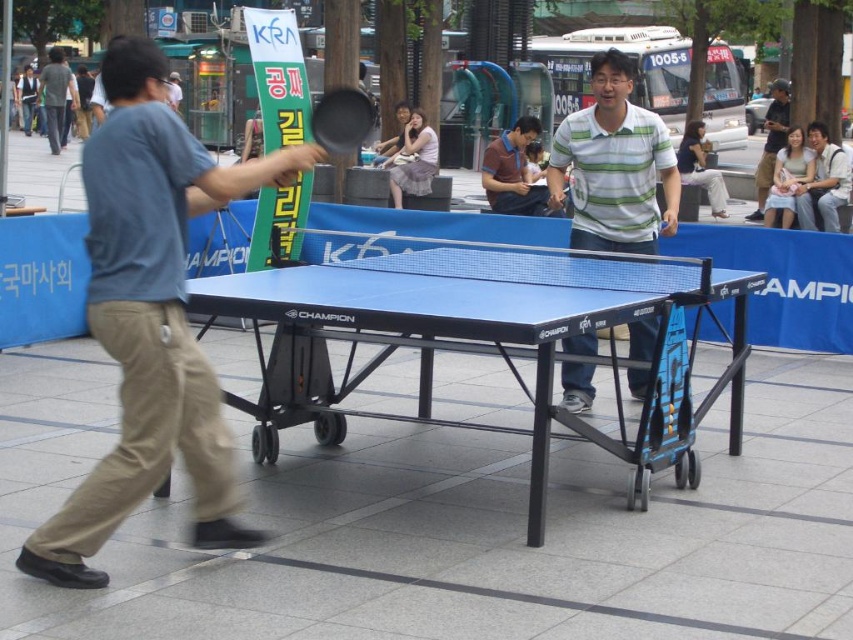
You are a photographer positioned at the edge of the plaza. You want to capture a photo where the light brown leather jacket at upper right is visible without being blocked by the dark blue jeans at center. Based on their current positions, is this possible?

Yes, the light brown leather jacket at upper right is in front of the dark blue jeans at center, so it will block the view of the jeans. Therefore, it is possible to capture the jacket without the jeans blocking it.

You are standing at the origin point in the center of the ping pong table. You want to move to the striped cotton shirt at center. Which direction should you go?

The striped cotton shirt at center is located at point 0.267 on the x axis and 0.601 on the y axis. Since you are at the origin, you should move towards the positive x and positive y direction to reach the striped cotton shirt at center.